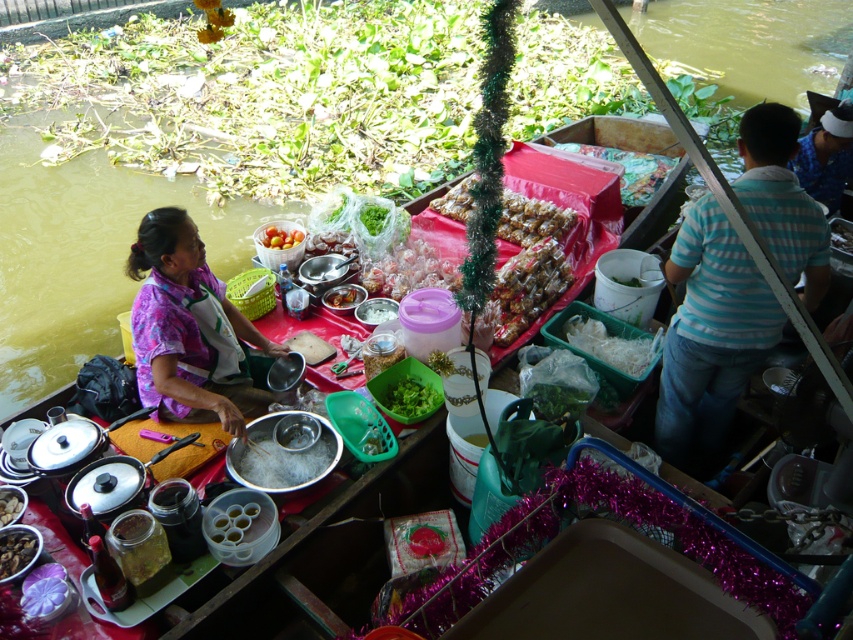
You are a customer at the floating market, and you want to walk from the blue striped shirt at right to the shiny silver bowl at center. Is there enough space for you to walk directly between them?

The distance between the blue striped shirt at right and the shiny silver bowl at center is 1.78 meters, so yes, there is enough space for you to walk directly between them since the distance is more than sufficient for a person to pass through.

You are a customer at the floating market. You see two items on the vendor table covered with a red cloth. The items are translucent plastic wrapped candies at center and smooth brown nuts at center. Which item is located to the right of the other?

The translucent plastic wrapped candies at center is positioned on the right side of smooth brown nuts at center.

You are a customer at the floating market and see the translucent plastic candy at center and the translucent plastic container at center on the vendor table. Which item is taller?

The translucent plastic candy at center is much taller than the translucent plastic container at center.